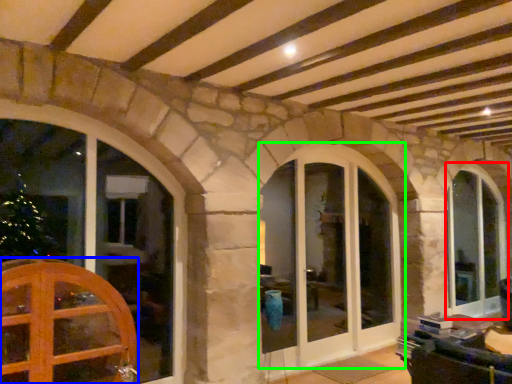
Question: Considering the real-world distances, which object is farthest from window (highlighted by a red box)? door (highlighted by a blue box) or window (highlighted by a green box)?

Choices:
 (A) door
 (B) window

Answer: (A)